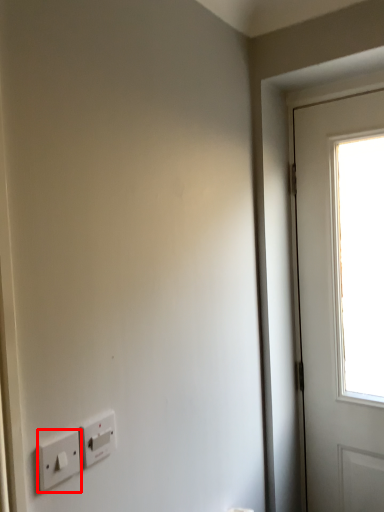
Question: From the image's perspective, where is light switch (annotated by the red box) located relative to light switch?

Choices:
 (A) below
 (B) above

Answer: (A)